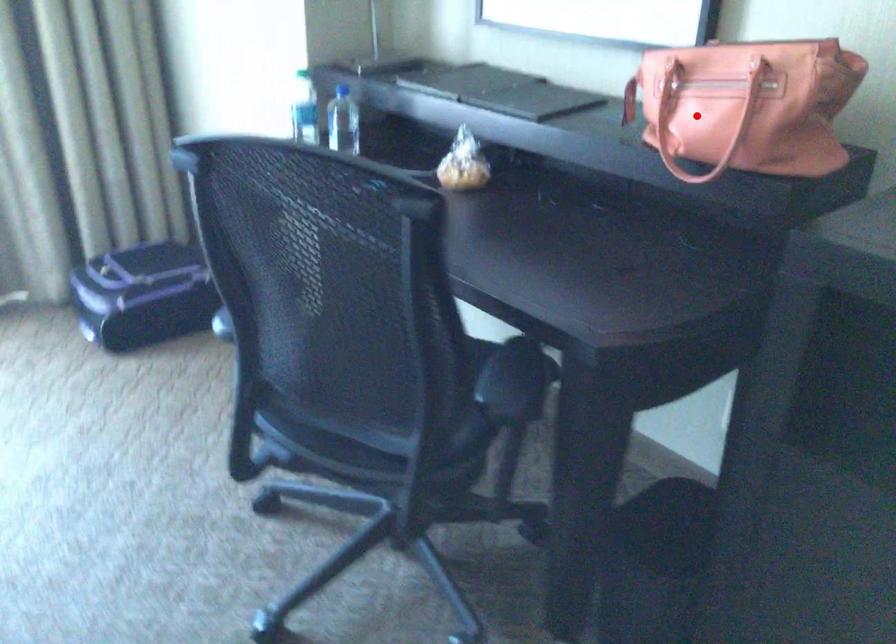
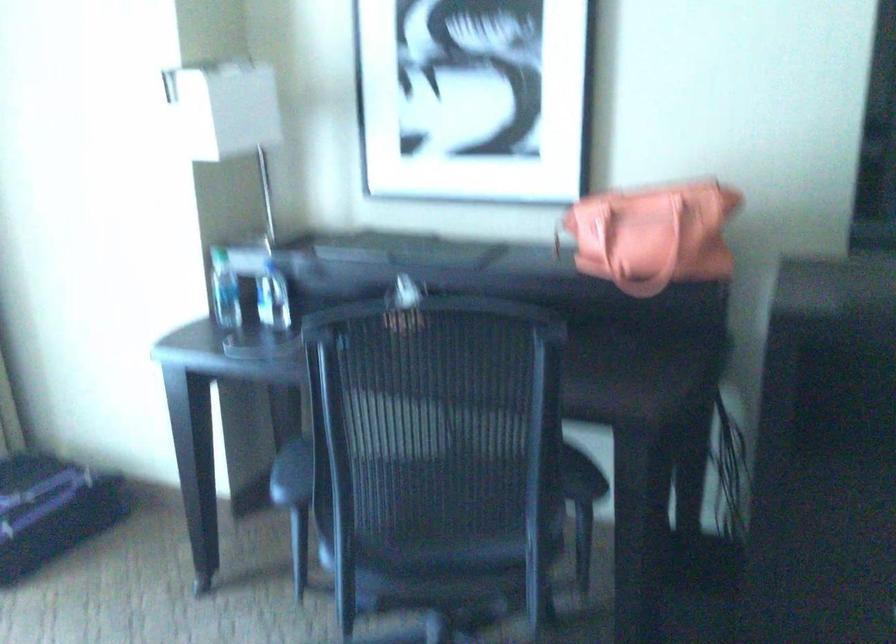
Locate, in the second image, the point that corresponds to the highlighted location in the first image.

(633, 238)